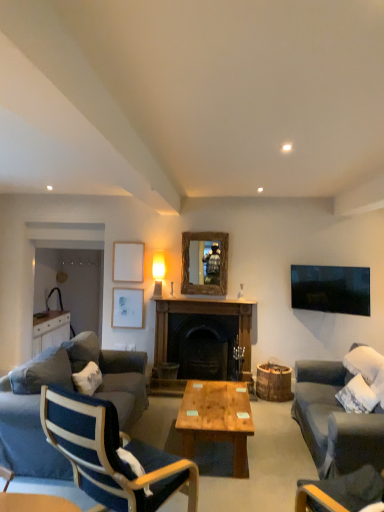
What is the approximate height of blue fabric chair at left, which is the second chair in right-to-left order?

blue fabric chair at left, which is the second chair in right-to-left order, is 38.98 inches tall.

Locate an element on the screen. white cotton pillow at left is located at coordinates (88, 379).

Where is `blue fabric chair at left, which is the second chair in right-to-left order`? The width and height of the screenshot is (384, 512). blue fabric chair at left, which is the second chair in right-to-left order is located at coordinates (111, 455).

Which is more to the left, dark gray fabric couch at right, which is counted as the first studio couch, starting from the front, or blue fabric chair at left, which is the second chair in right-to-left order?

From the viewer's perspective, blue fabric chair at left, which is the second chair in right-to-left order, appears more on the left side.

Considering the sizes of objects dark gray fabric couch at right, arranged as the second studio couch when viewed from the left, and blue fabric chair at left, which is the second chair in right-to-left order, in the image provided, who is bigger, dark gray fabric couch at right, arranged as the second studio couch when viewed from the left, or blue fabric chair at left, which is the second chair in right-to-left order,?

With larger size is blue fabric chair at left, which is the second chair in right-to-left order.

From the image's perspective, is dark gray fabric couch at right, the 1th studio couch from the right, under blue fabric chair at left, which is the second chair in right-to-left order?

No.

In the scene shown: Is dark gray fabric couch at right, arranged as the second studio couch when viewed from the back, facing towards blue fabric chair at left, which is the second chair in right-to-left order?

No, dark gray fabric couch at right, arranged as the second studio couch when viewed from the back, is not oriented towards blue fabric chair at left, which is the second chair in right-to-left order.

Is blue fabric couch at lower left, positioned as the first studio couch in back-to-front order, far away from dark wood fireplace at center?

Yes.

Which of these two, blue fabric couch at lower left, arranged as the 2th studio couch when viewed from the right, or dark wood fireplace at center, is smaller?

Smaller between the two is dark wood fireplace at center.

Is point (5, 426) positioned before point (165, 343)?

Yes.

From a real-world perspective, between blue fabric couch at lower left, which is counted as the first studio couch, starting from the left, and dark wood fireplace at center, who is vertically higher?

dark wood fireplace at center is physically above.

From the image's perspective, which is above, blue fabric couch at lower left, which is counted as the first studio couch, starting from the left, or white cotton pillow at left?

white cotton pillow at left.

Considering the sizes of blue fabric couch at lower left, which is counted as the first studio couch, starting from the left, and white cotton pillow at left in the image, is blue fabric couch at lower left, which is counted as the first studio couch, starting from the left, bigger or smaller than white cotton pillow at left?

Considering their sizes, blue fabric couch at lower left, which is counted as the first studio couch, starting from the left, takes up more space than white cotton pillow at left.

Considering the sizes of objects blue fabric couch at lower left, arranged as the 2th studio couch when viewed from the right, and white cotton pillow at left in the image provided, who is taller, blue fabric couch at lower left, arranged as the 2th studio couch when viewed from the right, or white cotton pillow at left?

Standing taller between the two is blue fabric couch at lower left, arranged as the 2th studio couch when viewed from the right.

Is blue fabric couch at lower left, positioned as the second studio couch in front-to-back order, further to the viewer compared to white cotton pillow at left?

No, it is in front of white cotton pillow at left.

Is blue fabric chair at left, which is the second chair in right-to-left order, next to velvet dark blue armchair at lower right, the first chair viewed from the right?

blue fabric chair at left, which is the second chair in right-to-left order, and velvet dark blue armchair at lower right, the first chair viewed from the right, are not in contact.

From the image's perspective, is blue fabric chair at left, which is the second chair in right-to-left order, below velvet dark blue armchair at lower right, the first chair viewed from the right?

No, from the image's perspective, blue fabric chair at left, which is the second chair in right-to-left order, is not beneath velvet dark blue armchair at lower right, the first chair viewed from the right.

Does blue fabric chair at left, which is the second chair in right-to-left order, have a larger size compared to velvet dark blue armchair at lower right, the first chair viewed from the right?

Yes.

Looking at this image, from a real-world perspective, which is physically above, velvet dark blue armchair at lower right, positioned as the 2th chair in left-to-right order, or dark wood fireplace at center?

dark wood fireplace at center.

From the image's perspective, does velvet dark blue armchair at lower right, the first chair viewed from the right, appear higher than dark wood fireplace at center?

Actually, velvet dark blue armchair at lower right, the first chair viewed from the right, appears below dark wood fireplace at center in the image.

Between velvet dark blue armchair at lower right, the first chair viewed from the right, and dark wood fireplace at center, which one has more height?

With more height is dark wood fireplace at center.

Can you confirm if velvet dark blue armchair at lower right, positioned as the 2th chair in left-to-right order, is wider than dark wood fireplace at center?

Correct, the width of velvet dark blue armchair at lower right, positioned as the 2th chair in left-to-right order, exceeds that of dark wood fireplace at center.

Between blue fabric chair at left, which ranks as the first chair in left-to-right order, and wooden mirror at center, which one has larger width?

blue fabric chair at left, which ranks as the first chair in left-to-right order, is wider.

Which object is further away from the camera taking this photo, blue fabric chair at left, which ranks as the first chair in left-to-right order, or wooden mirror at center?

Positioned behind is wooden mirror at center.

In terms of height, does blue fabric chair at left, which is the second chair in right-to-left order, look taller or shorter compared to wooden mirror at center?

Clearly, blue fabric chair at left, which is the second chair in right-to-left order, is taller compared to wooden mirror at center.

Could you measure the distance between blue fabric chair at left, which is the second chair in right-to-left order, and wooden mirror at center?

They are 10.22 feet apart.

How many degrees apart are the facing directions of white matte picture frame at upper center, the 1th picture frame in the top-to-bottom sequence, and velvet dark blue armchair at lower right, the first chair viewed from the right?

white matte picture frame at upper center, the 1th picture frame in the top-to-bottom sequence, and velvet dark blue armchair at lower right, the first chair viewed from the right, are facing 151 degrees away from each other.

Is white matte picture frame at upper center, the 1th picture frame in the top-to-bottom sequence, wider than velvet dark blue armchair at lower right, the first chair viewed from the right?

Incorrect, the width of white matte picture frame at upper center, the 1th picture frame in the top-to-bottom sequence, does not surpass that of velvet dark blue armchair at lower right, the first chair viewed from the right.

How much distance is there between white matte picture frame at upper center, which ranks as the second picture frame in bottom-to-top order, and velvet dark blue armchair at lower right, the first chair viewed from the right?

white matte picture frame at upper center, which ranks as the second picture frame in bottom-to-top order, and velvet dark blue armchair at lower right, the first chair viewed from the right, are 3.70 meters apart from each other.

From the image's perspective, does white matte picture frame at upper center, the 1th picture frame in the top-to-bottom sequence, appear lower than velvet dark blue armchair at lower right, positioned as the 2th chair in left-to-right order?

No.

Starting from the dark gray fabric couch at right, arranged as the second studio couch when viewed from the left, which chair is the 2nd one behind? Please provide its 2D coordinates.

[(111, 455)]

You are a GUI agent. You are given a task and a screenshot of the screen. Output one action in this format:
    pyautogui.click(x=<x>, y=<y>)
    Task: Click on the fireplace above the blue fabric couch at lower left, positioned as the first studio couch in back-to-front order (from the image's perspective)
    
    Given the screenshot: What is the action you would take?
    pyautogui.click(x=201, y=342)

Estimate the real-world distances between objects in this image. Which object is closer to blue fabric couch at lower left, positioned as the second studio couch in front-to-back order, dark gray fabric couch at right, arranged as the second studio couch when viewed from the left, or white matte picture frame at upper center, acting as the first picture frame starting from the bottom?

white matte picture frame at upper center, acting as the first picture frame starting from the bottom, is positioned closer to the anchor blue fabric couch at lower left, positioned as the second studio couch in front-to-back order.

Consider the image. Estimate the real-world distances between objects in this image. Which object is further from wooden/matte coffee table at center, blue fabric couch at lower left, positioned as the second studio couch in front-to-back order, or blue fabric chair at left, which is the second chair in right-to-left order?

Among the two, blue fabric chair at left, which is the second chair in right-to-left order, is located further to wooden/matte coffee table at center.

From the image, which object appears to be farther from white matte picture frame at upper center, which ranks as the second picture frame in bottom-to-top order, white cotton pillow at left or wooden mirror at center?

white cotton pillow at left is further to white matte picture frame at upper center, which ranks as the second picture frame in bottom-to-top order.

When comparing their distances from white matte picture frame at upper center, the 1th picture frame in the top-to-bottom sequence, does white cotton pillow at left or dark gray fabric couch at right, arranged as the second studio couch when viewed from the back, seem further?

dark gray fabric couch at right, arranged as the second studio couch when viewed from the back.

Based on their spatial positions, is velvet dark blue armchair at lower right, the first chair viewed from the right, or dark wood fireplace at center further from blue fabric chair at left, which ranks as the first chair in left-to-right order?

dark wood fireplace at center is further to blue fabric chair at left, which ranks as the first chair in left-to-right order.

Estimate the real-world distances between objects in this image. Which object is closer to blue fabric chair at left, which is the second chair in right-to-left order, wooden/matte coffee table at center or velvet dark blue armchair at lower right, positioned as the 2th chair in left-to-right order?

Based on the image, wooden/matte coffee table at center appears to be nearer to blue fabric chair at left, which is the second chair in right-to-left order.

Estimate the real-world distances between objects in this image. Which object is further from wooden/matte coffee table at center, dark gray fabric couch at right, arranged as the second studio couch when viewed from the left, or wooden mirror at center?

The object further to wooden/matte coffee table at center is wooden mirror at center.

Based on the photo, based on their spatial positions, is white matte picture frame at upper center, marked as the 2th picture frame in a top-to-bottom arrangement, or white matte picture frame at upper center, the 1th picture frame in the top-to-bottom sequence, further from dark gray fabric couch at right, the 1th studio couch from the right?

white matte picture frame at upper center, the 1th picture frame in the top-to-bottom sequence, is further to dark gray fabric couch at right, the 1th studio couch from the right.

Locate an element on the screen. The width and height of the screenshot is (384, 512). coffee table between dark gray fabric couch at right, which is counted as the first studio couch, starting from the front, and white cotton pillow at left from front to back is located at coordinates click(x=216, y=418).

At what (x,y) coordinates should I click in order to perform the action: click on studio couch positioned between velvet dark blue armchair at lower right, positioned as the 2th chair in left-to-right order, and dark wood fireplace at center from near to far. Please return your answer as a coordinate pair (x, y). This screenshot has height=512, width=384. Looking at the image, I should click on (27, 439).

At what (x,y) coordinates should I click in order to perform the action: click on picture frame between blue fabric couch at lower left, positioned as the second studio couch in front-to-back order, and white matte picture frame at upper center, marked as the 2th picture frame in a top-to-bottom arrangement, along the z-axis. Please return your answer as a coordinate pair (x, y). This screenshot has height=512, width=384. Looking at the image, I should click on (128, 262).

Identify the location of light between velvet dark blue armchair at lower right, the first chair viewed from the right, and white matte picture frame at upper center, which ranks as the second picture frame in bottom-to-top order, from front to back. This screenshot has height=512, width=384. (158, 272).